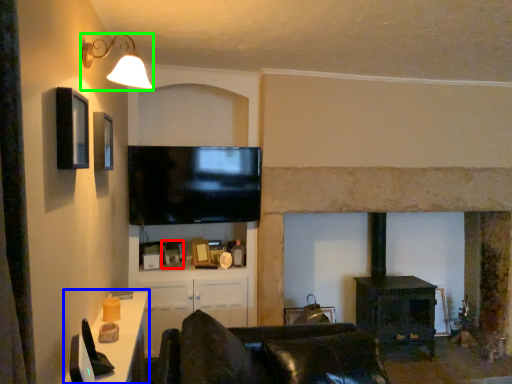
Question: Based on their relative distances, which object is farther from picture frame (highlighted by a red box)? Choose from table (highlighted by a blue box) and light fixture (highlighted by a green box).

Choices:
 (A) table
 (B) light fixture

Answer: (B)